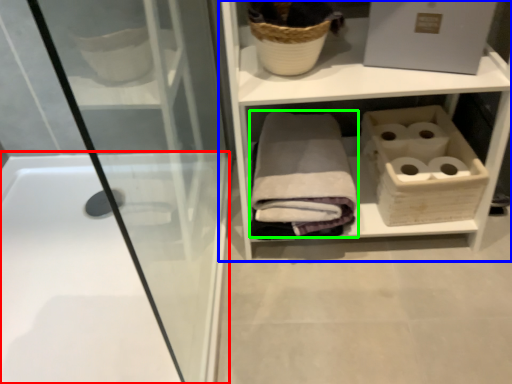
Question: Which object is positioned closest to bathtub (highlighted by a red box)? Select from shelf (highlighted by a blue box) and bath towel (highlighted by a green box).

Choices:
 (A) shelf
 (B) bath towel

Answer: (B)